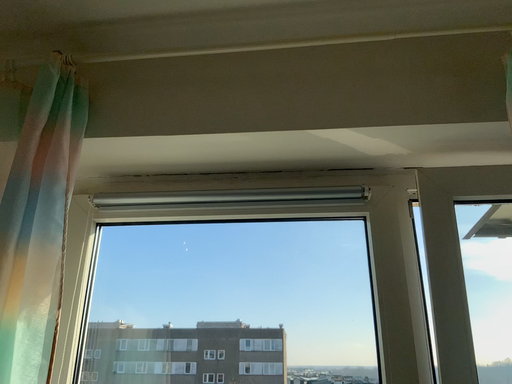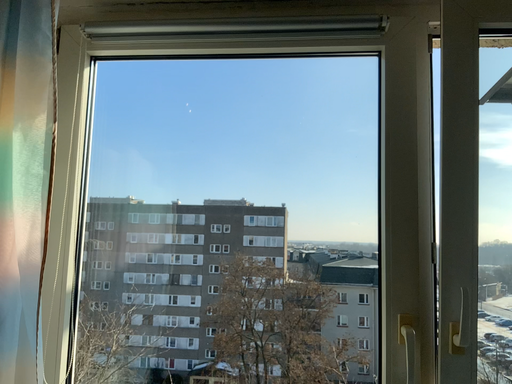
Question: Which way did the camera rotate in the video?

Choices:
 (A) rotated upward
 (B) rotated downward

Answer: (B)